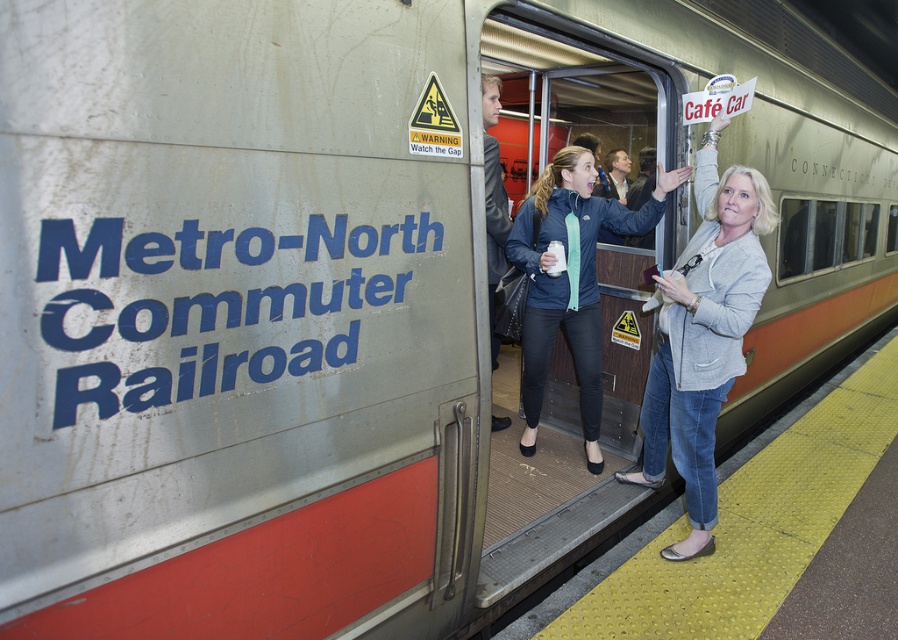
Question: Can you confirm if light gray blazer at center is smaller than dark gray jacket at center?

Choices:
 (A) yes
 (B) no

Answer: (B)

Question: Which point is farther to the camera?

Choices:
 (A) (720, 260)
 (B) (526, 266)

Answer: (B)

Question: Which object appears closest to the camera in this image?

Choices:
 (A) dark gray jacket at center
 (B) matte blue jacket at center

Answer: (A)

Question: Which object is closer to the camera taking this photo?

Choices:
 (A) dark gray jacket at center
 (B) light gray blazer at center
 (C) matte blue jacket at center

Answer: (A)

Question: In this image, where is light gray blazer at center located relative to dark gray jacket at center?

Choices:
 (A) right
 (B) left

Answer: (A)

Question: Is light gray blazer at center thinner than dark gray jacket at center?

Choices:
 (A) no
 (B) yes

Answer: (A)